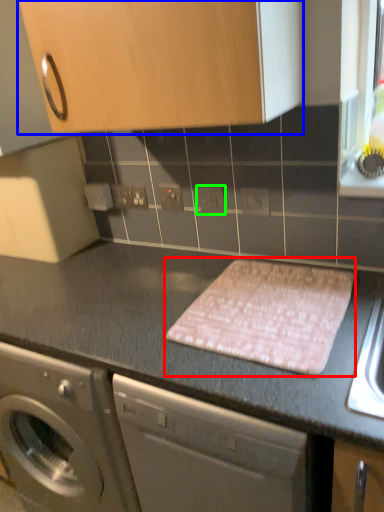
Question: Which is nearer to the blanket (highlighted by a red box)? cabinetry (highlighted by a blue box) or electric outlet (highlighted by a green box).

Choices:
 (A) cabinetry
 (B) electric outlet

Answer: (B)